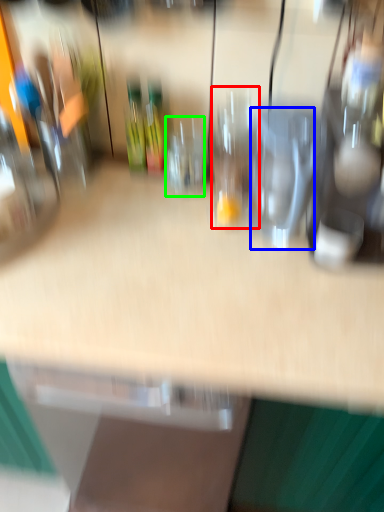
Question: Which is farther away from wine glass (highlighted by a red box)? wine glass (highlighted by a blue box) or wine glass (highlighted by a green box)?

Choices:
 (A) wine glass
 (B) wine glass

Answer: (A)